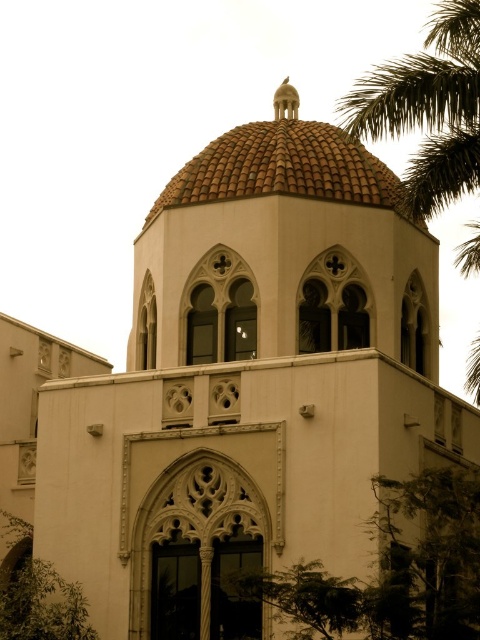
Question: Does green leafy tree at lower right appear on the left side of brown tiled dome at upper center?

Choices:
 (A) yes
 (B) no

Answer: (B)

Question: Which point is closer to the camera?

Choices:
 (A) (344, 588)
 (B) (466, 166)

Answer: (A)

Question: Which point is farther from the camera taking this photo?

Choices:
 (A) (357, 596)
 (B) (446, 202)

Answer: (B)

Question: Does green leafy tree at lower right come in front of green leafy palm tree at upper right?

Choices:
 (A) yes
 (B) no

Answer: (A)

Question: Is green leafy tree at lower right positioned behind green leafy palm tree at upper right?

Choices:
 (A) yes
 (B) no

Answer: (B)

Question: Which object is farther from the camera taking this photo?

Choices:
 (A) brown tiled dome at upper center
 (B) green leafy tree at lower right
 (C) green leafy palm tree at upper right

Answer: (A)